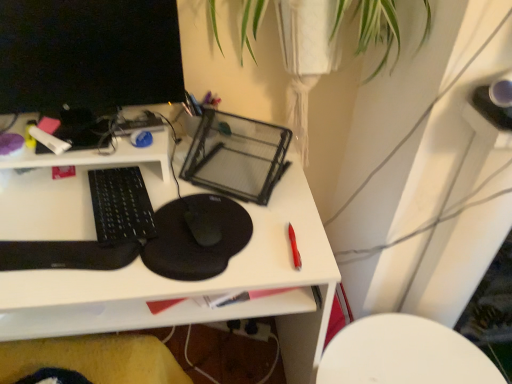
Where is `free space to the left of black matte mouse at center`? This screenshot has height=384, width=512. free space to the left of black matte mouse at center is located at coordinates (132, 220).